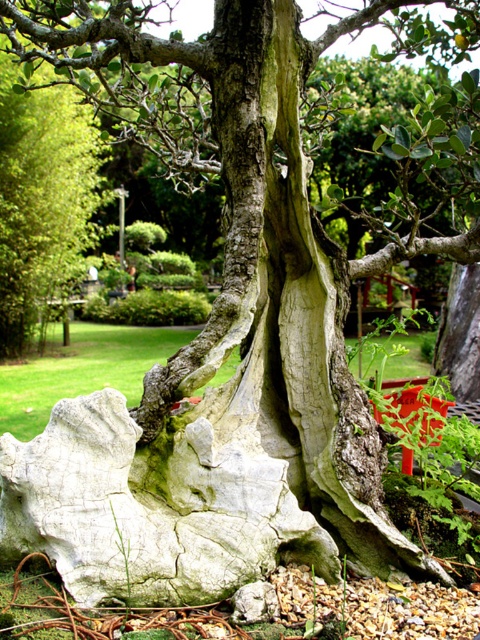
Does point (168, 532) come closer to viewer compared to point (43, 205)?

Yes, point (168, 532) is closer to viewer.

I want to click on white cracked rock at center, so click(x=149, y=509).

Between point (74, 451) and point (55, 172), which one is positioned in front?

Point (74, 451)

Locate an element on the screen. This screenshot has height=640, width=480. white cracked rock at center is located at coordinates (149, 509).